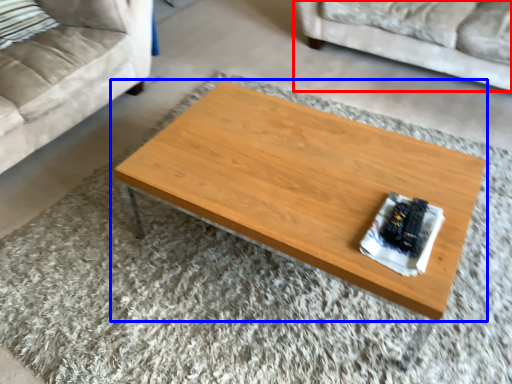
Question: Which object appears closest to the camera in this image, studio couch (highlighted by a red box) or coffee table (highlighted by a blue box)?

Choices:
 (A) studio couch
 (B) coffee table

Answer: (B)